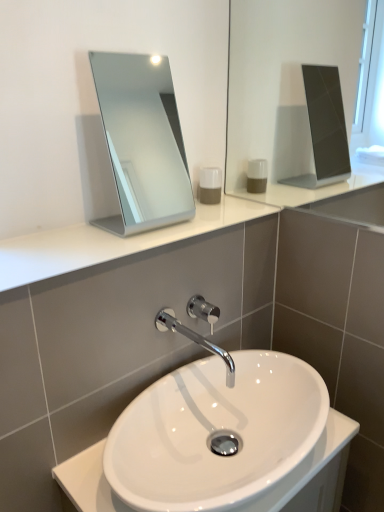
This screenshot has height=512, width=384. In order to click on free space in front of silver metallic mirror at upper center in this screenshot , I will do `click(124, 248)`.